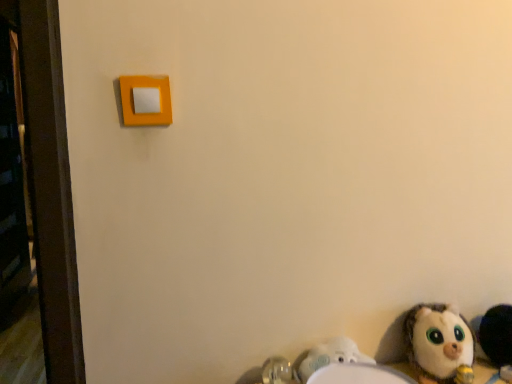
Question: Does white plastic sink at lower right have a smaller size compared to fluffy white stuffed animal at lower right, the 1th toy viewed from the right?

Choices:
 (A) no
 (B) yes

Answer: (B)

Question: Is the position of white plastic sink at lower right less distant than that of fluffy white stuffed animal at lower right, the 1th toy viewed from the right?

Choices:
 (A) yes
 (B) no

Answer: (A)

Question: Is fluffy white stuffed animal at lower right, placed as the second toy when sorted from left to right, located within white plastic sink at lower right?

Choices:
 (A) yes
 (B) no

Answer: (B)

Question: From a real-world perspective, is white plastic sink at lower right below fluffy white stuffed animal at lower right, the 1th toy viewed from the right?

Choices:
 (A) yes
 (B) no

Answer: (A)

Question: Can you confirm if white plastic sink at lower right is thinner than fluffy white stuffed animal at lower right, the 1th toy viewed from the right?

Choices:
 (A) no
 (B) yes

Answer: (B)

Question: Based on their sizes in the image, would you say fluffy white stuffed animal at lower right, the 1th toy viewed from the right, is bigger or smaller than matte orange light switch at upper left?

Choices:
 (A) big
 (B) small

Answer: (A)

Question: From the image's perspective, is fluffy white stuffed animal at lower right, the 1th toy viewed from the right, located above or below matte orange light switch at upper left?

Choices:
 (A) above
 (B) below

Answer: (B)

Question: Is point (505, 344) closer or farther from the camera than point (139, 89)?

Choices:
 (A) farther
 (B) closer

Answer: (A)

Question: In terms of height, does fluffy white stuffed animal at lower right, placed as the second toy when sorted from left to right, look taller or shorter compared to matte orange light switch at upper left?

Choices:
 (A) short
 (B) tall

Answer: (B)

Question: Considering the positions of white plush toy at lower right, arranged as the second toy when viewed from the right, and white plastic sink at lower right in the image, is white plush toy at lower right, arranged as the second toy when viewed from the right, taller or shorter than white plastic sink at lower right?

Choices:
 (A) short
 (B) tall

Answer: (B)

Question: Considering the positions of point (459, 324) and point (254, 370), is point (459, 324) closer or farther from the camera than point (254, 370)?

Choices:
 (A) closer
 (B) farther

Answer: (B)

Question: Considering the positions of white plush toy at lower right, arranged as the second toy when viewed from the right, and white plastic sink at lower right in the image, is white plush toy at lower right, arranged as the second toy when viewed from the right, bigger or smaller than white plastic sink at lower right?

Choices:
 (A) big
 (B) small

Answer: (A)

Question: Which is correct: white plush toy at lower right, which is counted as the 1th toy, starting from the left, is inside white plastic sink at lower right, or outside of it?

Choices:
 (A) outside
 (B) inside

Answer: (A)

Question: From a real-world perspective, is white plush toy at lower right, arranged as the second toy when viewed from the right, physically located above or below matte orange light switch at upper left?

Choices:
 (A) above
 (B) below

Answer: (B)

Question: From their relative heights in the image, would you say white plush toy at lower right, arranged as the second toy when viewed from the right, is taller or shorter than matte orange light switch at upper left?

Choices:
 (A) short
 (B) tall

Answer: (B)